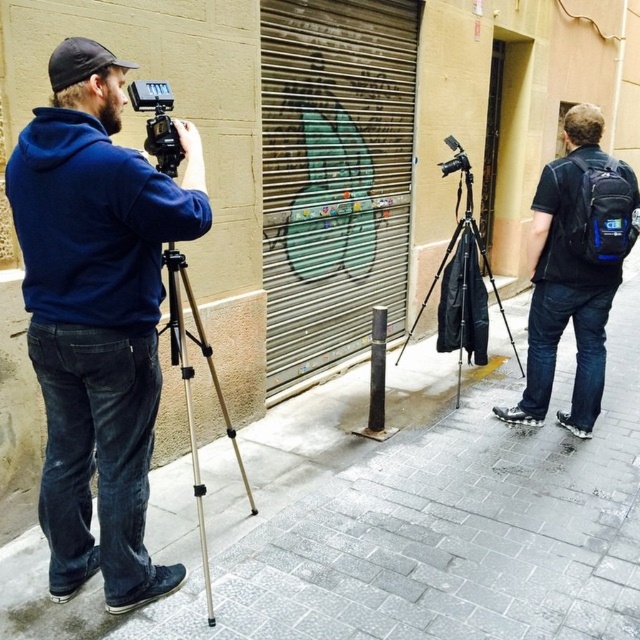
You are a photographer trying to set up your equipment. You have a matte black camera at left and a matte black tripod at center. According to the scene, which object is more to the left?

The matte black camera at left is more to the left than the matte black tripod at center.

You are a photographer carrying a blue fabric backpack at right. You want to move from your current position to adjust the camera. Is the distance between you and the camera sufficient to walk comfortably without needing to move the backpack?

The distance between the blue fabric backpack at right and the camera is 3.37 meters, which is more than enough space to walk comfortably without needing to move the backpack.

You are standing in front of the shutter door with graffiti art and want to place two markers on the wall. The first marker should be at point (60, 394) and the second at point (378, 305). Which marker will appear closer to you when viewed from your current position?

The marker at point (60, 394) will appear closer to you because it is closer to the viewer than point (378, 305) according to the spatial description.